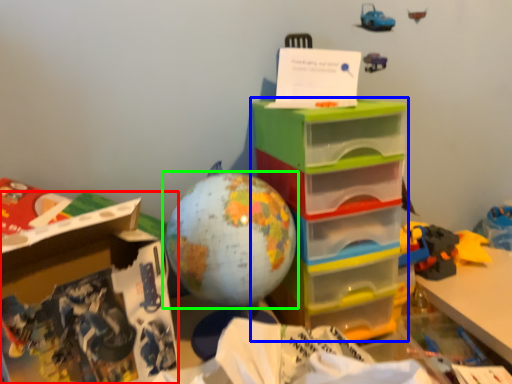
Question: Which is nearer to the cardboard box (highlighted by a red box)? storage box (highlighted by a blue box) or toy (highlighted by a green box).

Choices:
 (A) storage box
 (B) toy

Answer: (B)